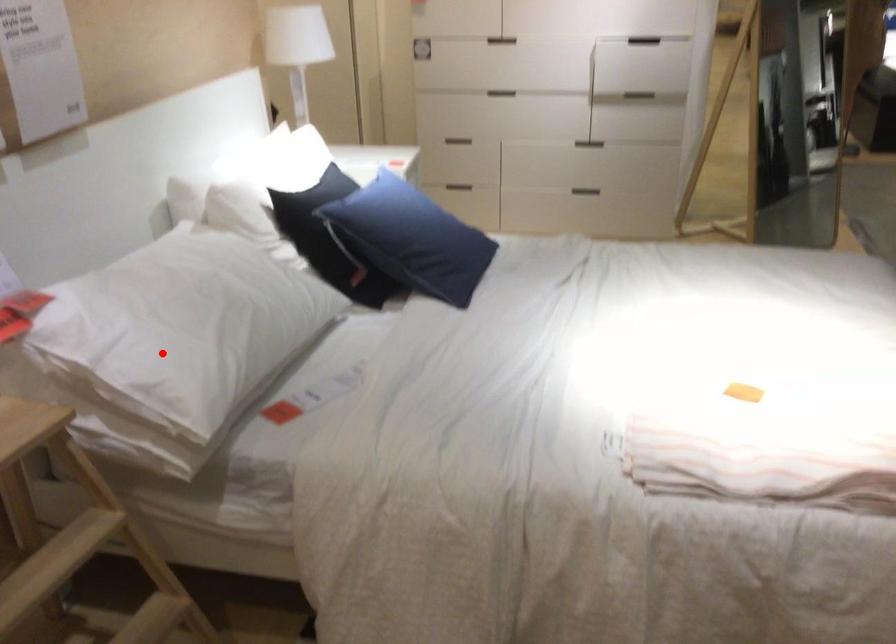
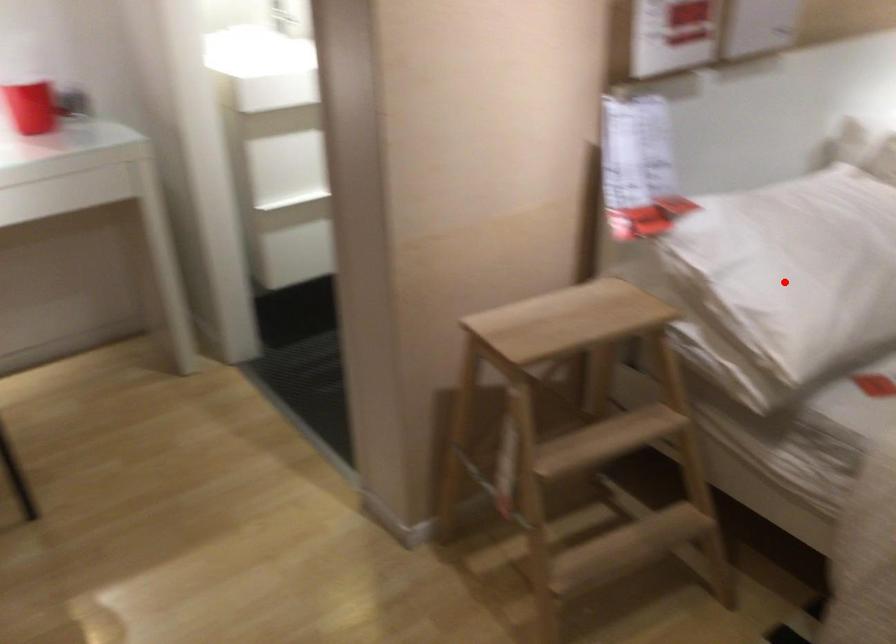
I am providing you with two images of the same scene from different viewpoints. A red point is marked on the first image and another point is marked on the second image. Are the points marked in image1 and image2 representing the same 3D position?

Yes